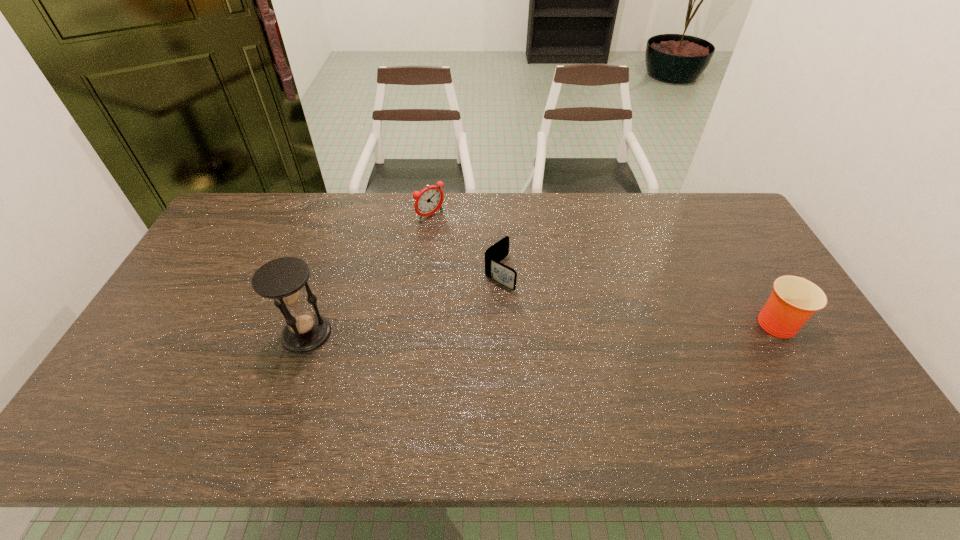
The width and height of the screenshot is (960, 540). Find the location of `free spot on the desktop that is between the tallest object and the cup and is positioned on the outer surface of the wallet`. free spot on the desktop that is between the tallest object and the cup and is positioned on the outer surface of the wallet is located at coordinates (589, 326).

I want to click on free space on the desktop that is between the hourglass and the cup and is positioned on the front-facing side of the farthest object, so 560,327.